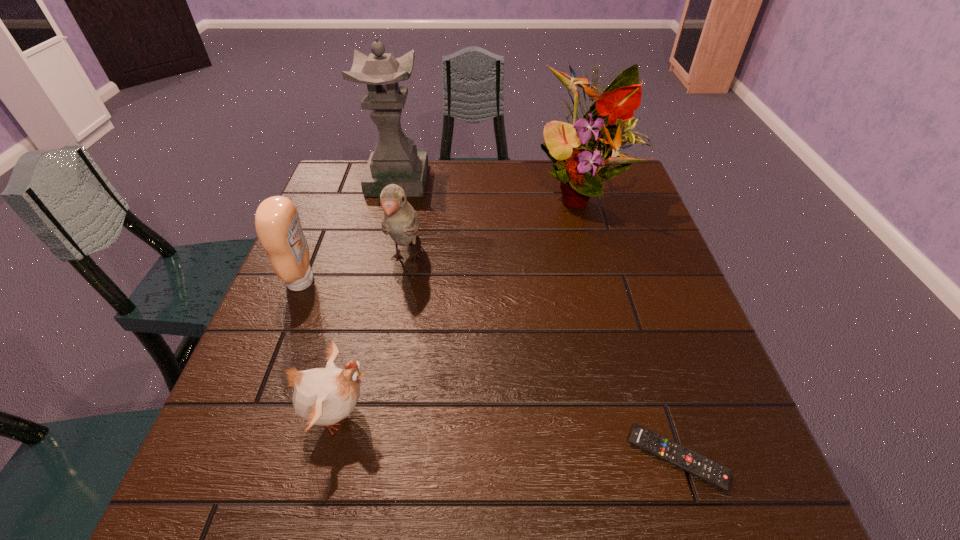
You are a GUI agent. You are given a task and a screenshot of the screen. Output one action in this format:
    pyautogui.click(x=<x>, y=<y>)
    Task: Click on the sculpture
    
    Given the screenshot: What is the action you would take?
    pyautogui.click(x=395, y=160)

You are a GUI agent. You are given a task and a screenshot of the screen. Output one action in this format:
    pyautogui.click(x=<x>, y=<y>)
    Task: Click on the bouquet
    
    Given the screenshot: What is the action you would take?
    pyautogui.click(x=582, y=159)

Identify the location of the farther bird. (399, 220).

This screenshot has height=540, width=960. Identify the location of the leftmost object. (277, 223).

Find the location of a particular element. the nearer bird is located at coordinates (322, 396).

Image resolution: width=960 pixels, height=540 pixels. Identify the location of the shorter bird. (322, 396).

Image resolution: width=960 pixels, height=540 pixels. I want to click on the shortest object, so pyautogui.click(x=688, y=460).

Find the location of a particular element. This screenshot has width=960, height=540. vacant space located 0.180m at the front opening of the sculpture is located at coordinates (486, 180).

This screenshot has width=960, height=540. I want to click on blank space located 0.140m on the front-facing side of the bouquet, so click(x=600, y=262).

Image resolution: width=960 pixels, height=540 pixels. What are the coordinates of `vacant region located at the face of the taller bird` in the screenshot? It's located at (394, 331).